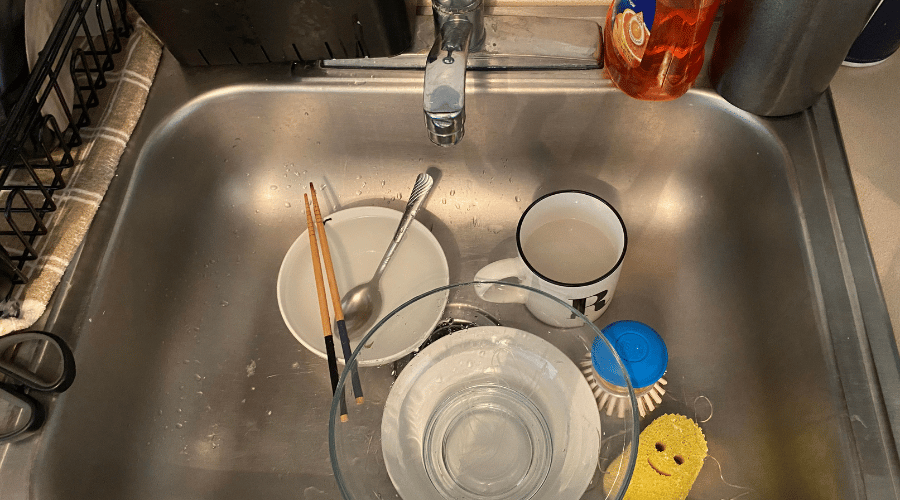
Where is `mug`? mug is located at coordinates (612, 282).